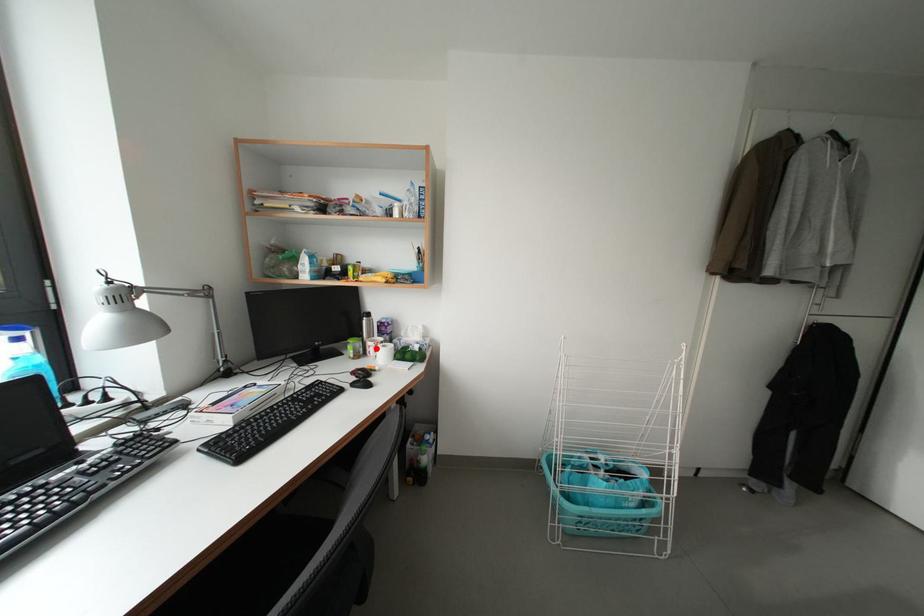
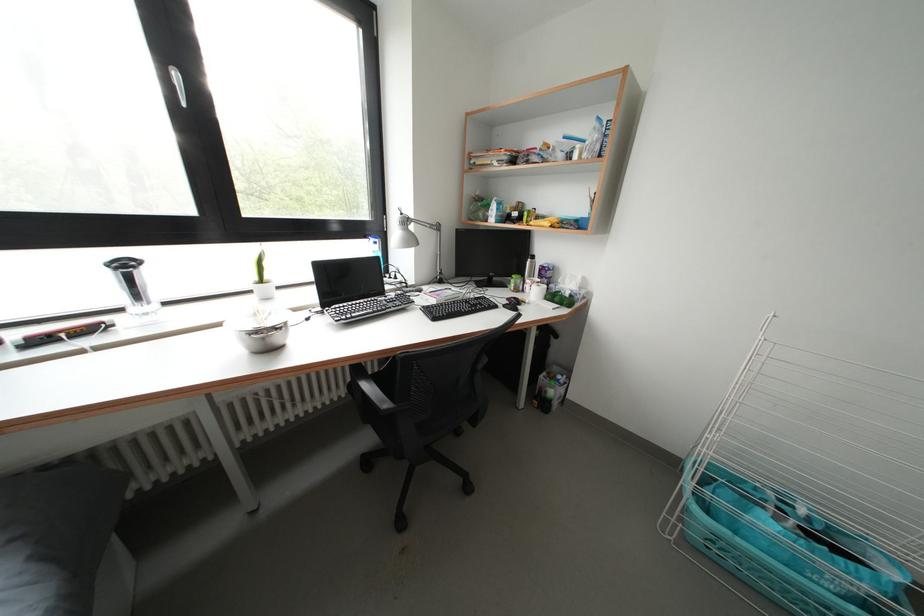
In the second image, find the point that corresponds to the highlighted location in the first image.

(535, 286)